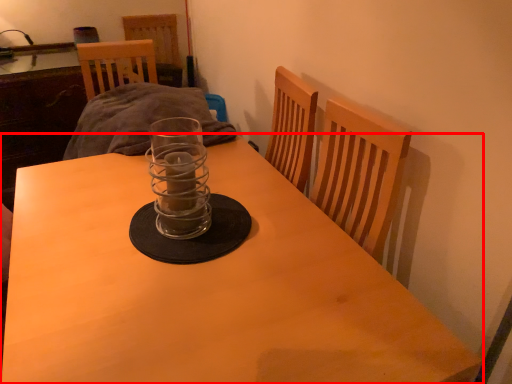
Question: Where is table (annotated by the red box) located in relation to candle holder in the image?

Choices:
 (A) left
 (B) right

Answer: (A)